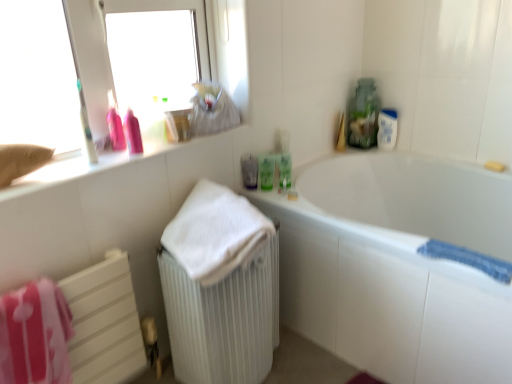
In order to face pink plastic spray bottle at upper left, placed as the first cleaning product when sorted from right to left, should I rotate leftwards or rightwards?

You should rotate left by 16.232 degrees.

This screenshot has width=512, height=384. Identify the location of white cotton towel at center, the second bath towel when ordered from right to left. click(x=215, y=233).

What do you see at coordinates (223, 320) in the screenshot? I see `white ribbed radiator at lower left` at bounding box center [223, 320].

How much space does translucent plastic cup at center, arranged as the 3th mouthwash when viewed from the right, occupy horizontally?

4.66 centimeters.

Find the location of a particular element. The height and width of the screenshot is (384, 512). white plastic bottle at upper right is located at coordinates (387, 128).

Where is `pink plastic spray bottle at upper left, placed as the first cleaning product when sorted from right to left`? pink plastic spray bottle at upper left, placed as the first cleaning product when sorted from right to left is located at coordinates (132, 133).

Where is `mouthwash that is the 3rd object to the right of the white ribbed radiator at lower left, starting at the anchor`? The height and width of the screenshot is (384, 512). mouthwash that is the 3rd object to the right of the white ribbed radiator at lower left, starting at the anchor is located at coordinates (284, 172).

Considering their positions, is white ribbed radiator at lower left located in front of or behind green matte bottle at upper right, which is the 3th mouthwash from left to right?

In the image, white ribbed radiator at lower left appears in front of green matte bottle at upper right, which is the 3th mouthwash from left to right.

Could you measure the distance between white ribbed radiator at lower left and green matte bottle at upper right, which is the first mouthwash in right-to-left order?

They are 60.57 centimeters apart.

Does white ribbed radiator at lower left have a lesser height compared to green matte bottle at upper right, which is the first mouthwash in right-to-left order?

Incorrect, the height of white ribbed radiator at lower left does not fall short of that of green matte bottle at upper right, which is the first mouthwash in right-to-left order.

Consider the image. From a real-world perspective, is green matte bottle at upper right, which is the first mouthwash in right-to-left order, above or below white glossy bathtub at center?

Clearly, from a real-world perspective, green matte bottle at upper right, which is the first mouthwash in right-to-left order, is above white glossy bathtub at center.

From the picture: What's the angular difference between green matte bottle at upper right, which is the 3th mouthwash from left to right, and white glossy bathtub at center's facing directions?

They differ by 63.7 degrees in their facing directions.

Is green matte bottle at upper right, which is the first mouthwash in right-to-left order, aimed at white glossy bathtub at center?

No, green matte bottle at upper right, which is the first mouthwash in right-to-left order, is not oriented towards white glossy bathtub at center.

Is green matte bottle at upper right, which is the 3th mouthwash from left to right, at the left side of white glossy bathtub at center?

Yes.

Which is more to the left, matte white counter at upper left or green matte bottle at upper right, which is the first mouthwash in right-to-left order?

Positioned to the left is matte white counter at upper left.

From the image's perspective, is matte white counter at upper left below green matte bottle at upper right, which is the first mouthwash in right-to-left order?

No, from the image's perspective, matte white counter at upper left is not below green matte bottle at upper right, which is the first mouthwash in right-to-left order.

Is matte white counter at upper left taller than green matte bottle at upper right, which is the 3th mouthwash from left to right?

No.

Can green matte bottle at upper right, which is the first mouthwash in right-to-left order, be found inside matte white counter at upper left?

That's incorrect, green matte bottle at upper right, which is the first mouthwash in right-to-left order, is not inside matte white counter at upper left.

Which object is positioned more to the right, green matte bottle at upper right, which is the 3th mouthwash from left to right, or white cotton towel at center, placed as the 2th bath towel when sorted from left to right?

From the viewer's perspective, green matte bottle at upper right, which is the 3th mouthwash from left to right, appears more on the right side.

From the white cotton towel at center, placed as the 2th bath towel when sorted from left to right, count 3rd mouthwash to the right and point to it. Please provide its 2D coordinates.

[(284, 172)]

Between green matte bottle at upper right, which is the first mouthwash in right-to-left order, and white cotton towel at center, the second bath towel when ordered from right to left, which one has smaller size?

green matte bottle at upper right, which is the first mouthwash in right-to-left order, is smaller.

Is the depth of pink plastic spray bottle at upper left, which is the 2th cleaning product in left-to-right order, greater than that of green plastic mouthwash at upper center, positioned as the second mouthwash in right-to-left order?

No, it is not.

Is pink plastic spray bottle at upper left, placed as the first cleaning product when sorted from right to left, at the left side of green plastic mouthwash at upper center, the second mouthwash from the left?

Yes, pink plastic spray bottle at upper left, placed as the first cleaning product when sorted from right to left, is to the left of green plastic mouthwash at upper center, the second mouthwash from the left.

From the picture: In terms of height, does pink plastic spray bottle at upper left, placed as the first cleaning product when sorted from right to left, look taller or shorter compared to green plastic mouthwash at upper center, the second mouthwash from the left?

Clearly, pink plastic spray bottle at upper left, placed as the first cleaning product when sorted from right to left, is taller compared to green plastic mouthwash at upper center, the second mouthwash from the left.

Is point (138, 133) more distant than point (270, 158)?

No, it is in front of (270, 158).

Between white cotton towel at center, the second bath towel when ordered from right to left, and matte white counter at upper left, which one has larger width?

Wider between the two is white cotton towel at center, the second bath towel when ordered from right to left.

Relative to matte white counter at upper left, is white cotton towel at center, the second bath towel when ordered from right to left, in front or behind?

In the image, white cotton towel at center, the second bath towel when ordered from right to left, appears in front of matte white counter at upper left.

Are pink matte bottle at upper left, which is the second cleaning product in right-to-left order, and white cotton towel at center, the second bath towel when ordered from right to left, located far from each other?

pink matte bottle at upper left, which is the second cleaning product in right-to-left order, is near white cotton towel at center, the second bath towel when ordered from right to left, not far away.

Could you tell me if pink matte bottle at upper left, the 1th cleaning product from the left, is facing white cotton towel at center, the second bath towel when ordered from right to left?

No, pink matte bottle at upper left, the 1th cleaning product from the left, is not oriented towards white cotton towel at center, the second bath towel when ordered from right to left.

Considering the sizes of pink matte bottle at upper left, which is the second cleaning product in right-to-left order, and white cotton towel at center, placed as the 2th bath towel when sorted from left to right, in the image, is pink matte bottle at upper left, which is the second cleaning product in right-to-left order, bigger or smaller than white cotton towel at center, placed as the 2th bath towel when sorted from left to right,?

Considering their sizes, pink matte bottle at upper left, which is the second cleaning product in right-to-left order, takes up less space than white cotton towel at center, placed as the 2th bath towel when sorted from left to right.

Locate an element on the screen. Image resolution: width=512 pixels, height=384 pixels. the 2nd bath towel in front of the pink matte bottle at upper left, the 1th cleaning product from the left is located at coordinates (215, 233).

I want to click on bath heater below the green matte bottle at upper right, which is the first mouthwash in right-to-left order (from a real-world perspective), so click(x=223, y=320).

This screenshot has width=512, height=384. Identify the location of bathtub below the green matte bottle at upper right, which is the 3th mouthwash from left to right (from the image's perspective). (397, 266).

Which object lies nearer to the anchor point green plastic mouthwash at upper center, the second mouthwash from the left, matte white counter at upper left or pink plastic spray bottle at upper left, which is the 2th cleaning product in left-to-right order?

The object closer to green plastic mouthwash at upper center, the second mouthwash from the left, is matte white counter at upper left.

Considering their positions, is white cotton towel at center, placed as the 2th bath towel when sorted from left to right, positioned closer to pink plastic spray bottle at upper left, which is the 2th cleaning product in left-to-right order, than green plastic mouthwash at upper center, positioned as the second mouthwash in right-to-left order?

The object closer to pink plastic spray bottle at upper left, which is the 2th cleaning product in left-to-right order, is white cotton towel at center, placed as the 2th bath towel when sorted from left to right.

Based on their spatial positions, is yellow matte bar of soap at upper right or white ribbed radiator at lower left further from blue textured bath towel at lower right, acting as the first bath towel starting from the right?

yellow matte bar of soap at upper right is further to blue textured bath towel at lower right, acting as the first bath towel starting from the right.

Estimate the real-world distances between objects in this image. Which object is further from pink matte bottle at upper left, the 1th cleaning product from the left, white glossy bathtub at center or pink fabric towel at lower left, the third bath towel viewed from the right?

white glossy bathtub at center is positioned further to the anchor pink matte bottle at upper left, the 1th cleaning product from the left.

Looking at the image, which one is located closer to green matte bottle at upper right, which is the first mouthwash in right-to-left order, white cotton towel at center, placed as the 2th bath towel when sorted from left to right, or white ribbed radiator at lower left?

Among the two, white cotton towel at center, placed as the 2th bath towel when sorted from left to right, is located nearer to green matte bottle at upper right, which is the first mouthwash in right-to-left order.

Estimate the real-world distances between objects in this image. Which object is further from white glossy bathtub at center, pink plastic spray bottle at upper left, which is the 2th cleaning product in left-to-right order, or matte white counter at upper left?

pink plastic spray bottle at upper left, which is the 2th cleaning product in left-to-right order, is positioned further to the anchor white glossy bathtub at center.

Estimate the real-world distances between objects in this image. Which object is closer to white glossy bathtub at center, pink fabric towel at lower left, the third bath towel viewed from the right, or matte white counter at upper left?

matte white counter at upper left is positioned closer to the anchor white glossy bathtub at center.

Estimate the real-world distances between objects in this image. Which object is further from pink plastic spray bottle at upper left, which is the 2th cleaning product in left-to-right order, pink fabric towel at lower left, the third bath towel viewed from the right, or white cotton towel at center, placed as the 2th bath towel when sorted from left to right?

pink fabric towel at lower left, the third bath towel viewed from the right, lies further to pink plastic spray bottle at upper left, which is the 2th cleaning product in left-to-right order, than the other object.

What are the coordinates of `cleaning product located between pink matte bottle at upper left, the 1th cleaning product from the left, and yellow matte bar of soap at upper right in the left-right direction` in the screenshot? It's located at (132, 133).

Find the location of a particular element. This screenshot has width=512, height=384. bath heater between pink fabric towel at lower left, which is the 1th bath towel in left-to-right order, and white glossy bathtub at center, in the horizontal direction is located at coordinates (223, 320).

This screenshot has width=512, height=384. I want to click on cleaning product between pink matte bottle at upper left, the 1th cleaning product from the left, and green plastic mouthwash at upper center, positioned as the second mouthwash in right-to-left order, from left to right, so click(132, 133).

You are a GUI agent. You are given a task and a screenshot of the screen. Output one action in this format:
    pyautogui.click(x=<x>, y=<y>)
    Task: Click on the counter top between white cotton towel at center, the second bath towel when ordered from right to left, and green matte bottle at upper right, which is the 3th mouthwash from left to right, from front to back
    This screenshot has height=384, width=512.
    Given the screenshot: What is the action you would take?
    pyautogui.click(x=141, y=164)